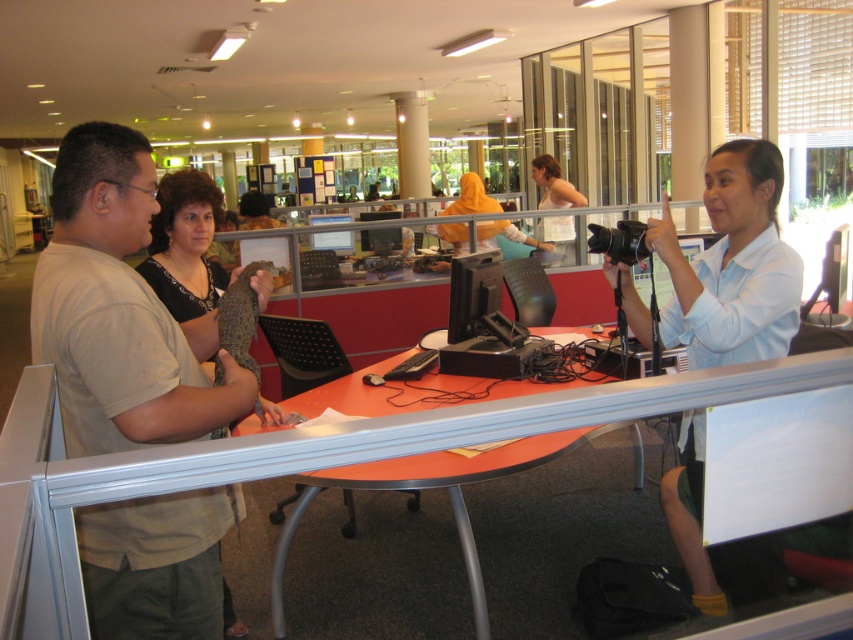
Question: Which point is farther from the camera taking this photo?

Choices:
 (A) (492, 241)
 (B) (746, 333)
 (C) (186, 195)
 (D) (370, 570)

Answer: (A)

Question: Is light brown leather jacket at left thinner than orange fabric headscarf at center?

Choices:
 (A) no
 (B) yes

Answer: (B)

Question: Is orange plastic table at center thinner than orange fabric headscarf at center?

Choices:
 (A) yes
 (B) no

Answer: (B)

Question: Can you confirm if light brown leather jacket at left is positioned to the right of white tank top at upper center?

Choices:
 (A) yes
 (B) no

Answer: (B)

Question: Estimate the real-world distances between objects in this image. Which object is farther from the orange fabric headscarf at center?

Choices:
 (A) light brown leather jacket at left
 (B) light brown shirt at left
 (C) light blue shirt at right

Answer: (B)

Question: Which of these objects is positioned farthest from the orange plastic table at center?

Choices:
 (A) light brown leather jacket at left
 (B) light brown shirt at left
 (C) orange fabric headscarf at center
 (D) light blue shirt at right

Answer: (C)